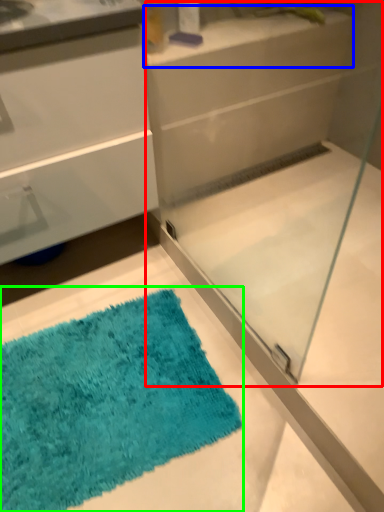
Question: Which object is the closest to the glass box (highlighted by a red box)? Choose among these: counter top (highlighted by a blue box) or bath mat (highlighted by a green box).

Choices:
 (A) counter top
 (B) bath mat

Answer: (A)